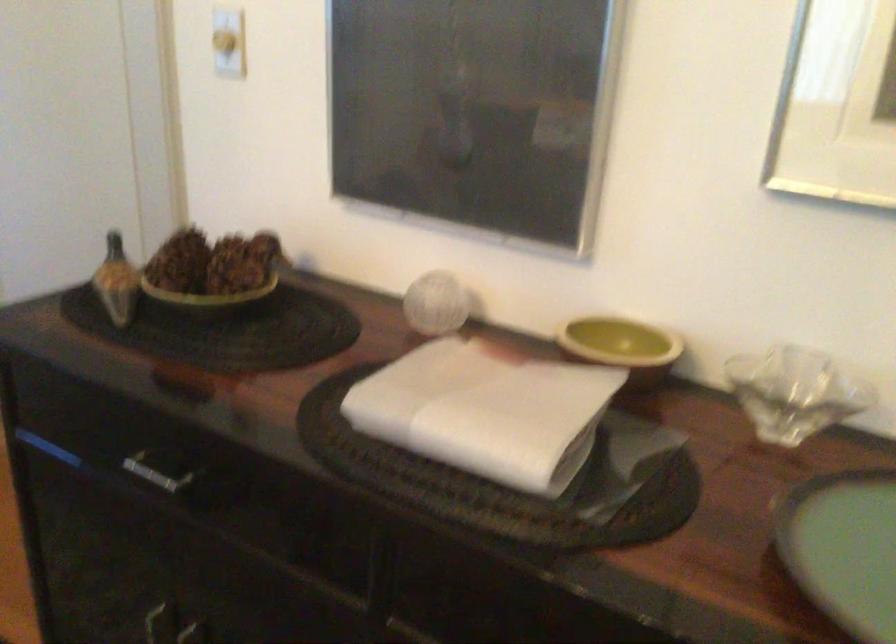
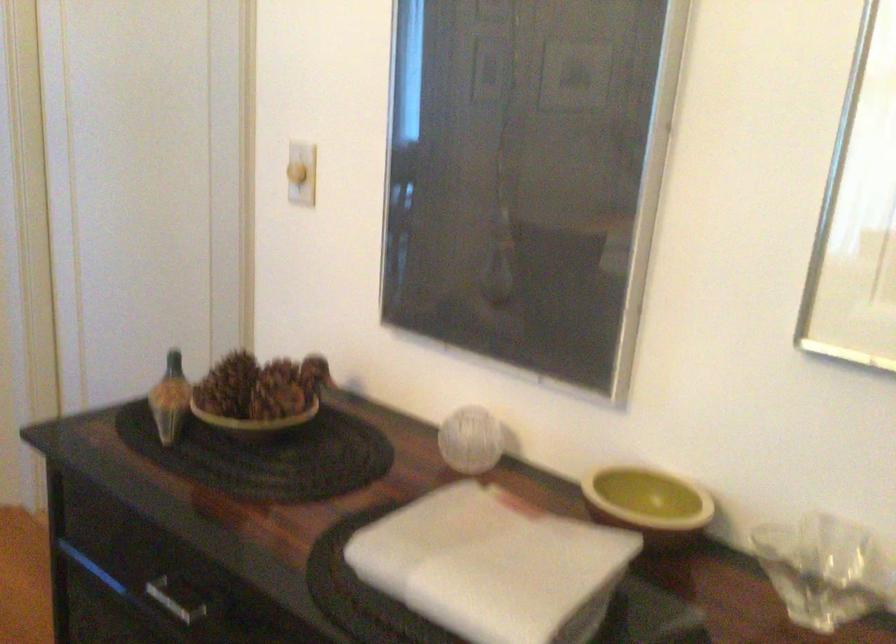
Locate, in the second image, the point that corresponds to point 117,281 in the first image.

(169, 399)